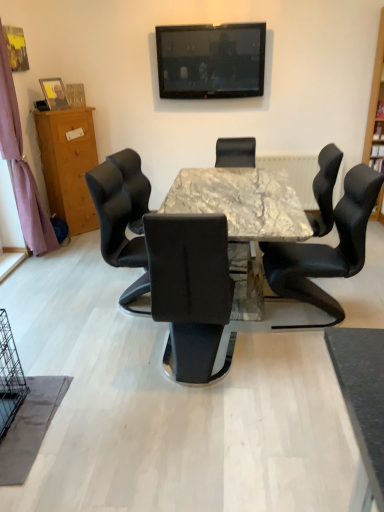
This screenshot has height=512, width=384. I want to click on marble table at center, so (x=241, y=202).

The width and height of the screenshot is (384, 512). What are the coordinates of `black leather chair at right, the third chair in the back-to-front sequence` in the screenshot? It's located at (326, 249).

This screenshot has width=384, height=512. What do you see at coordinates (211, 61) in the screenshot?
I see `black glossy television at upper center` at bounding box center [211, 61].

The image size is (384, 512). What are the coordinates of `wooden cabinet at left` in the screenshot? It's located at (68, 164).

This screenshot has height=512, width=384. Identify the location of marble table at center. pyautogui.click(x=241, y=202).

Between point (49, 101) and point (367, 119), which one is positioned in front?

The point (49, 101) is closer.

Is matte wooden picture frame at left far away from wooden bookshelf at right?

matte wooden picture frame at left is positioned a significant distance from wooden bookshelf at right.

Which object is closer to the camera, matte wooden picture frame at left or wooden bookshelf at right?

wooden bookshelf at right is more forward.

Considering the relative sizes of matte wooden picture frame at left and wooden bookshelf at right in the image provided, is matte wooden picture frame at left bigger than wooden bookshelf at right?

No, matte wooden picture frame at left is not bigger than wooden bookshelf at right.

Considering the positions of objects black leather chair at center, which is the 2th chair in back-to-front order, and black glossy television at upper center in the image provided, who is in front, black leather chair at center, which is the 2th chair in back-to-front order, or black glossy television at upper center?

black leather chair at center, which is the 2th chair in back-to-front order, is in front.

Can you confirm if black leather chair at center, positioned as the second chair in front-to-back order, is wider than black glossy television at upper center?

Indeed, black leather chair at center, positioned as the second chair in front-to-back order, has a greater width compared to black glossy television at upper center.

Are black leather chair at center, positioned as the second chair in front-to-back order, and black glossy television at upper center located far from each other?

Yes, black leather chair at center, positioned as the second chair in front-to-back order, and black glossy television at upper center are located far from each other.

Is black leather chair at center, positioned as the second chair in front-to-back order, looking in the opposite direction of black glossy television at upper center?

No, black leather chair at center, positioned as the second chair in front-to-back order,'s orientation is not away from black glossy television at upper center.

Which point is more forward, (70, 145) or (6, 147)?

The point (6, 147) is closer to the camera.

How much distance is there between wooden cabinet at left and purple fabric curtain at left?

wooden cabinet at left is 18.75 inches from purple fabric curtain at left.

Is wooden cabinet at left surrounding purple fabric curtain at left?

No, purple fabric curtain at left is not inside wooden cabinet at left.

Considering the relative sizes of wooden cabinet at left and purple fabric curtain at left in the image provided, is wooden cabinet at left thinner than purple fabric curtain at left?

In fact, wooden cabinet at left might be wider than purple fabric curtain at left.

From the picture: Which object is further away from the camera, black leather chair at right, the third chair in the back-to-front sequence, or black glossy television at upper center?

black glossy television at upper center.

Which of these two, black leather chair at right, the first chair from the front, or black glossy television at upper center, stands shorter?

Standing shorter between the two is black glossy television at upper center.

Choose the correct answer: Is black leather chair at right, the third chair in the back-to-front sequence, inside black glossy television at upper center or outside it?

black leather chair at right, the third chair in the back-to-front sequence, is spatially situated outside black glossy television at upper center.

Which object is thinner, black leather chair at right, the first chair from the front, or black glossy television at upper center?

black glossy television at upper center.

Would you consider wooden bookshelf at right to be distant from matte wooden picture frame at left?

Indeed, wooden bookshelf at right is not near matte wooden picture frame at left.

Which is behind, wooden bookshelf at right or matte wooden picture frame at left?

matte wooden picture frame at left.

From the image's perspective, which one is positioned lower, wooden bookshelf at right or matte wooden picture frame at left?

wooden bookshelf at right appears lower in the image.

Is wooden bookshelf at right at the left side of matte wooden picture frame at left?

No.

Is wooden bookshelf at right taller than black leather chair at center, the first chair viewed from the back?

Yes.

What are the coordinates of `the 1st chair in front of the wooden bookshelf at right, starting your count from the anchor` in the screenshot? It's located at (235, 152).

Which object is closer to the camera taking this photo, wooden bookshelf at right or black leather chair at center, acting as the third chair starting from the front?

black leather chair at center, acting as the third chair starting from the front, is in front.

From a real-world perspective, which is physically above, wooden bookshelf at right or black leather chair at center, acting as the third chair starting from the front?

wooden bookshelf at right is physically above.

Which is more to the left, black leather chair at center, acting as the third chair starting from the front, or black leather chair at center, which is the 2th chair in back-to-front order?

From the viewer's perspective, black leather chair at center, acting as the third chair starting from the front, appears more on the left side.

From the image's perspective, would you say black leather chair at center, the first chair viewed from the back, is shown under black leather chair at center, positioned as the second chair in front-to-back order?

Actually, black leather chair at center, the first chair viewed from the back, appears above black leather chair at center, positioned as the second chair in front-to-back order, in the image.

Would you say black leather chair at center, acting as the third chair starting from the front, is outside black leather chair at center, which is the 2th chair in back-to-front order?

black leather chair at center, acting as the third chair starting from the front, lies outside black leather chair at center, which is the 2th chair in back-to-front order,'s area.

From the picture: Would you say black leather chair at center, the first chair viewed from the back, is a long distance from black leather chair at center, positioned as the second chair in front-to-back order?

That's right, there is a large distance between black leather chair at center, the first chair viewed from the back, and black leather chair at center, positioned as the second chair in front-to-back order.

Identify the location of picture frame above the wooden bookshelf at right (from a real-world perspective). This screenshot has width=384, height=512. (54, 93).

From a real-world perspective, starting from the black glossy television at upper center, which chair is the 3rd one below it? Please provide its 2D coordinates.

[(324, 190)]

Looking at the image, which one is located closer to wooden cabinet at left, black leather chair at center, positioned as the second chair in front-to-back order, or black leather chair at center, the first chair viewed from the back?

Based on the image, black leather chair at center, the first chair viewed from the back, appears to be nearer to wooden cabinet at left.

From the image, which object appears to be nearer to matte wooden picture frame at left, black glossy television at upper center or black leather chair at center, which is the 2th chair in back-to-front order?

Among the two, black glossy television at upper center is located nearer to matte wooden picture frame at left.

Considering their positions, is black leather chair at center, which is the 2th chair in back-to-front order, positioned closer to purple fabric curtain at left than wooden bookshelf at right?

Among the two, black leather chair at center, which is the 2th chair in back-to-front order, is located nearer to purple fabric curtain at left.

From the image, which object appears to be farther from matte wooden picture frame at left, marble table at center or black glossy television at upper center?

Based on the image, marble table at center appears to be further to matte wooden picture frame at left.

Which object lies nearer to the anchor point purple fabric curtain at left, black leather chair at right, the first chair from the front, or wooden bookshelf at right?

The object closer to purple fabric curtain at left is black leather chair at right, the first chair from the front.

Considering their positions, is wooden cabinet at left positioned further to black leather chair at right, the third chair in the back-to-front sequence, than black glossy television at upper center?

wooden cabinet at left is further to black leather chair at right, the third chair in the back-to-front sequence.

Which object lies further to the anchor point black leather chair at center, the first chair viewed from the back, purple fabric curtain at left or black glossy television at upper center?

The object further to black leather chair at center, the first chair viewed from the back, is purple fabric curtain at left.

Looking at the image, which one is located further to black leather chair at right, the third chair in the back-to-front sequence, wooden bookshelf at right or black leather chair at center, positioned as the second chair in front-to-back order?

wooden bookshelf at right.

This screenshot has height=512, width=384. What are the coordinates of `television situated between purple fabric curtain at left and black leather chair at center, which is the 2th chair in back-to-front order, from left to right` in the screenshot? It's located at (211, 61).

Find the location of a particular element. picture frame between purple fabric curtain at left and black leather chair at center, acting as the third chair starting from the front, in the horizontal direction is located at coordinates (54, 93).

You are a GUI agent. You are given a task and a screenshot of the screen. Output one action in this format:
    pyautogui.click(x=<x>, y=<y>)
    Task: Click on the cabinetry between matte wooden picture frame at left and black glossy television at upper center from left to right
    
    Given the screenshot: What is the action you would take?
    pyautogui.click(x=68, y=164)

At what (x,y) coordinates should I click in order to perform the action: click on desk between wooden cabinet at left and wooden bookshelf at right in the horizontal direction. Please return your answer as a coordinate pair (x, y). This screenshot has height=512, width=384. Looking at the image, I should click on (241, 202).